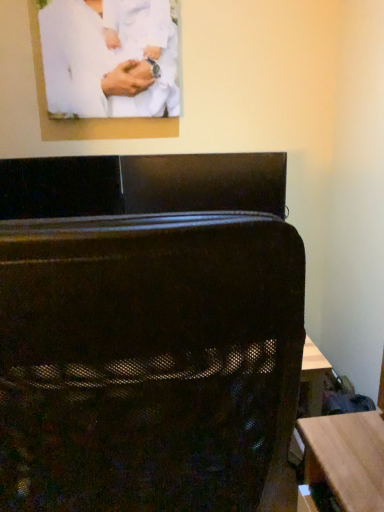
Question: Considering the positions of black mesh suitcase at center and white matte clothing at upper center in the image, is black mesh suitcase at center bigger or smaller than white matte clothing at upper center?

Choices:
 (A) big
 (B) small

Answer: (A)

Question: From the image's perspective, is black mesh suitcase at center located above or below white matte clothing at upper center?

Choices:
 (A) below
 (B) above

Answer: (A)

Question: Considering the relative positions of black mesh suitcase at center and white matte clothing at upper center in the image provided, is black mesh suitcase at center to the left or to the right of white matte clothing at upper center?

Choices:
 (A) left
 (B) right

Answer: (B)

Question: Is white matte clothing at upper center wider or thinner than black mesh suitcase at center?

Choices:
 (A) wide
 (B) thin

Answer: (B)

Question: From the image's perspective, relative to black mesh suitcase at center, is white matte clothing at upper center above or below?

Choices:
 (A) above
 (B) below

Answer: (A)

Question: Does point (173, 74) appear closer or farther from the camera than point (87, 479)?

Choices:
 (A) closer
 (B) farther

Answer: (B)

Question: Is white matte clothing at upper center taller or shorter than black mesh suitcase at center?

Choices:
 (A) tall
 (B) short

Answer: (B)